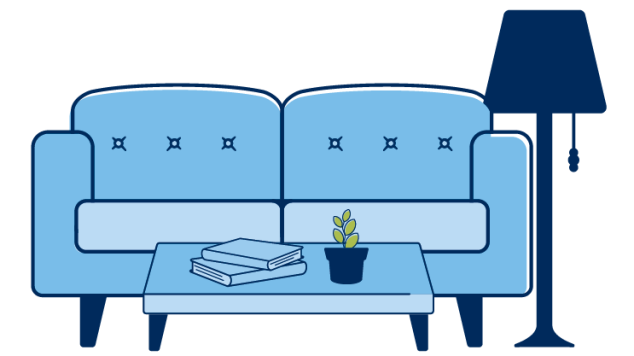
Where is `blue couch`? Image resolution: width=634 pixels, height=356 pixels. blue couch is located at coordinates (421, 112).